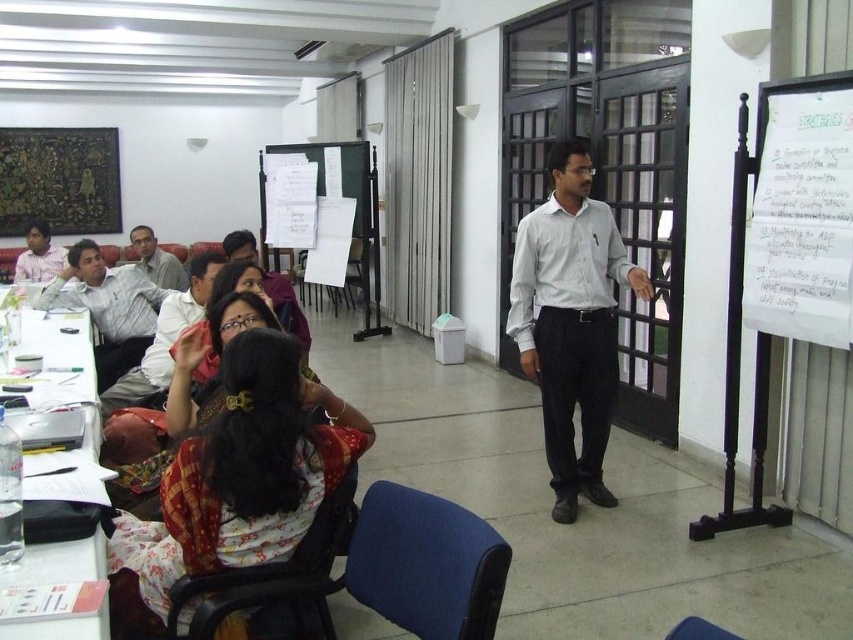
Who is lower down, white striped shirt at center or matte pink shirt at upper left?

white striped shirt at center

Describe the element at coordinates (572, 321) in the screenshot. I see `white striped shirt at center` at that location.

Describe the element at coordinates (572, 321) in the screenshot. The height and width of the screenshot is (640, 853). I see `white striped shirt at center` at that location.

Find the location of a particular element. This screenshot has height=640, width=853. white striped shirt at center is located at coordinates pyautogui.click(x=572, y=321).

Who is positioned more to the right, white paper at upper right or white shirt at upper left?

white paper at upper right

Is white paper at upper right positioned behind white shirt at upper left?

No.

Locate an element on the screen. This screenshot has width=853, height=640. white paper at upper right is located at coordinates (802, 212).

Which is more to the left, white plastic table at left or matte gray shirt at upper left?

matte gray shirt at upper left is more to the left.

Which is behind, point (71, 492) or point (144, 237)?

The point (144, 237) is more distant.

What do you see at coordinates (62, 403) in the screenshot?
I see `white plastic table at left` at bounding box center [62, 403].

Locate an element on the screen. white plastic table at left is located at coordinates (62, 403).